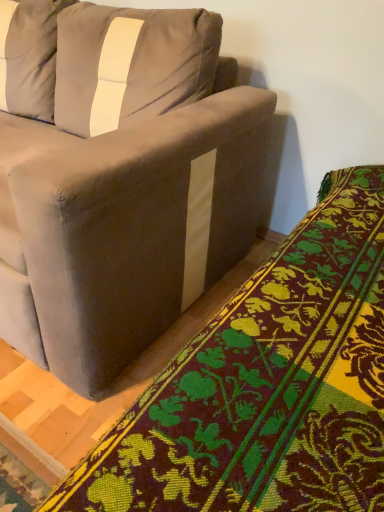
Question: Is suede-like gray couch at upper left bigger or smaller than velvet-like green and yellow floral blanket at lower right?

Choices:
 (A) small
 (B) big

Answer: (B)

Question: Is point (0, 133) positioned closer to the camera than point (203, 354)?

Choices:
 (A) farther
 (B) closer

Answer: (A)

Question: From the image's perspective, is suede-like gray couch at upper left above or below velvet-like green and yellow floral blanket at lower right?

Choices:
 (A) below
 (B) above

Answer: (B)

Question: Considering the positions of velvet-like green and yellow floral blanket at lower right and suede-like gray couch at upper left in the image, is velvet-like green and yellow floral blanket at lower right bigger or smaller than suede-like gray couch at upper left?

Choices:
 (A) big
 (B) small

Answer: (B)

Question: From the image's perspective, is velvet-like green and yellow floral blanket at lower right positioned above or below suede-like gray couch at upper left?

Choices:
 (A) above
 (B) below

Answer: (B)

Question: Looking at their shapes, would you say velvet-like green and yellow floral blanket at lower right is wider or thinner than suede-like gray couch at upper left?

Choices:
 (A) wide
 (B) thin

Answer: (B)

Question: Is velvet-like green and yellow floral blanket at lower right in front of or behind suede-like gray couch at upper left in the image?

Choices:
 (A) front
 (B) behind

Answer: (A)